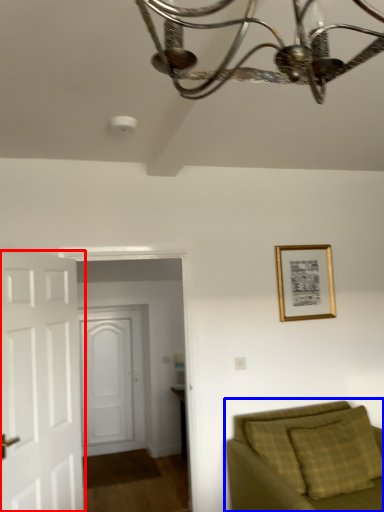
Question: Which object is further to the camera taking this photo, door (highlighted by a red box) or studio couch (highlighted by a blue box)?

Choices:
 (A) door
 (B) studio couch

Answer: (A)